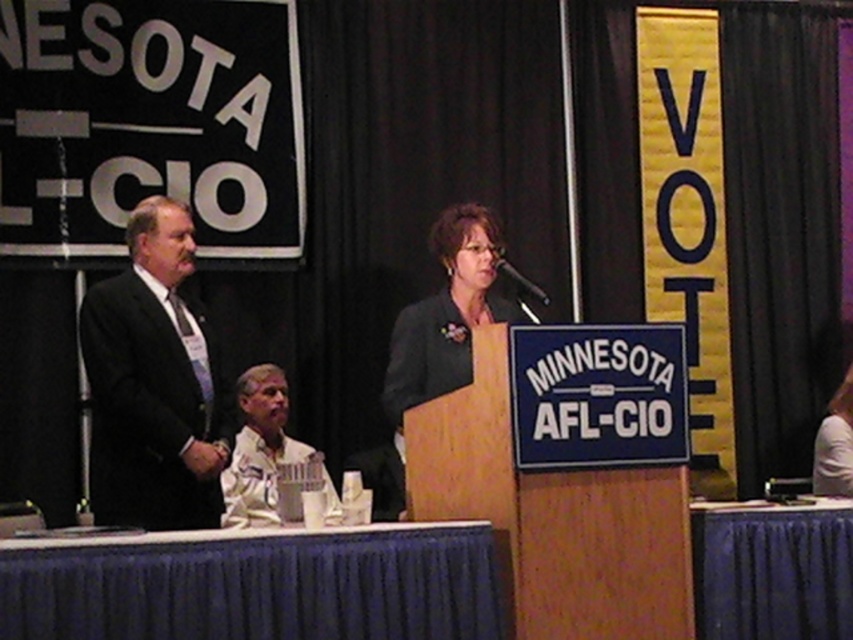
Question: Which point appears closest to the camera in this image?

Choices:
 (A) (398, 394)
 (B) (263, 460)
 (C) (137, 413)

Answer: (C)

Question: Is matte black suit at left bigger than black plastic microphone at center?

Choices:
 (A) no
 (B) yes

Answer: (B)

Question: Observing the image, what is the correct spatial positioning of white shirt at lower left in reference to white fabric shirt at lower right?

Choices:
 (A) above
 (B) below

Answer: (B)

Question: Which is farther from the matte black suit at left?

Choices:
 (A) white shirt at lower left
 (B) white fabric shirt at lower right
 (C) matte black blazer at center
 (D) black plastic microphone at center

Answer: (B)

Question: Which of the following is the closest to the observer?

Choices:
 (A) (483, 236)
 (B) (543, 296)
 (C) (247, 429)
 (D) (97, 419)

Answer: (D)

Question: Observing the image, what is the correct spatial positioning of matte black suit at left in reference to matte black blazer at center?

Choices:
 (A) right
 (B) left

Answer: (B)